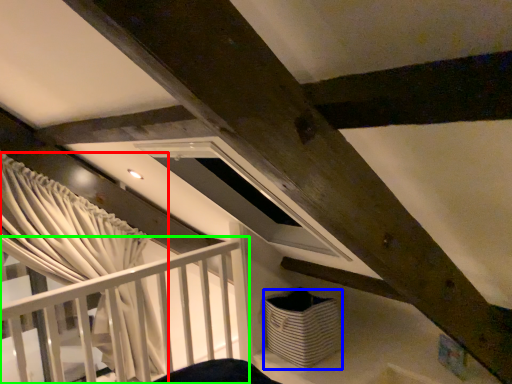
Question: Estimate the real-world distances between objects in this image. Which object is closer to curtain (highlighted by a red box), basket (highlighted by a blue box) or rail (highlighted by a green box)?

Choices:
 (A) basket
 (B) rail

Answer: (B)